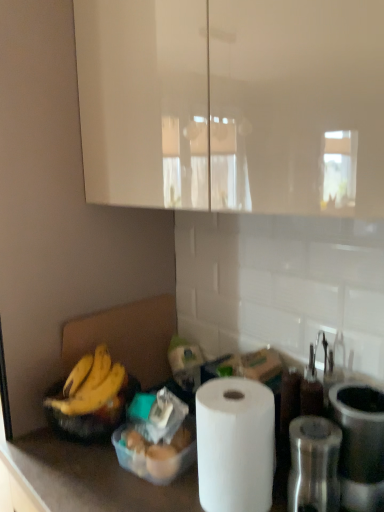
Question: From the image's perspective, relative to yellow matte bananas at lower left, is white matte paper towel at lower center above or below?

Choices:
 (A) below
 (B) above

Answer: (A)

Question: Choose the correct answer: Is white matte paper towel at lower center inside yellow matte bananas at lower left or outside it?

Choices:
 (A) outside
 (B) inside

Answer: (A)

Question: Based on their relative distances, which object is farther from the yellow matte bananas at lower left?

Choices:
 (A) translucent plastic container at lower center
 (B) metallic silver canister at right, which ranks as the 1th appliance in right-to-left order
 (C) metallic silver grinder at right, placed as the 1th appliance when sorted from left to right
 (D) white matte paper towel at lower center

Answer: (B)

Question: Which object is positioned closest to the yellow matte bananas at lower left?

Choices:
 (A) metallic silver canister at right, which ranks as the 1th appliance in right-to-left order
 (B) metallic silver grinder at right, which is the second appliance from right to left
 (C) white matte paper towel at lower center
 (D) translucent plastic container at lower center

Answer: (D)